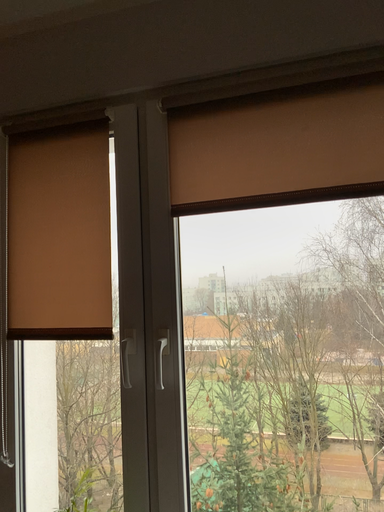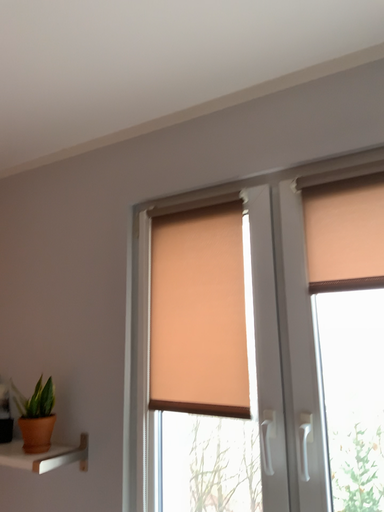
Question: Which way did the camera rotate in the video?

Choices:
 (A) rotated downward
 (B) rotated upward

Answer: (B)